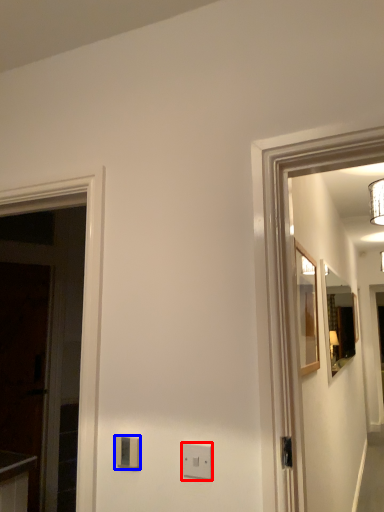
Question: Among these objects, which one is farthest to the camera, light switch (highlighted by a red box) or light switch (highlighted by a blue box)?

Choices:
 (A) light switch
 (B) light switch

Answer: (B)